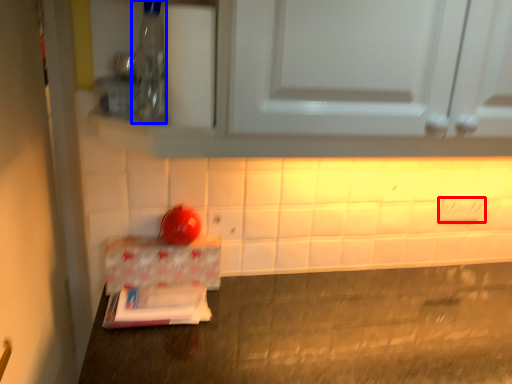
Question: Which point is further to the camera, electric outlet (highlighted by a red box) or bottle (highlighted by a blue box)?

Choices:
 (A) electric outlet
 (B) bottle

Answer: (A)